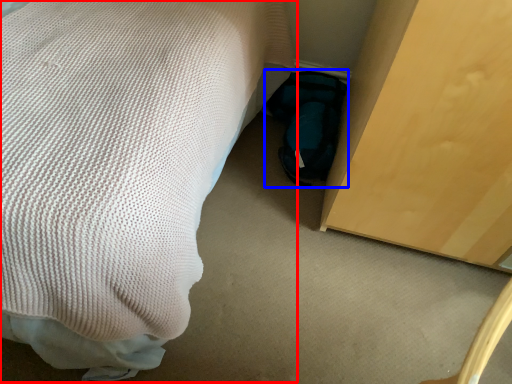
Question: Which point is further to the camera, bed (highlighted by a red box) or bag (highlighted by a blue box)?

Choices:
 (A) bed
 (B) bag

Answer: (B)